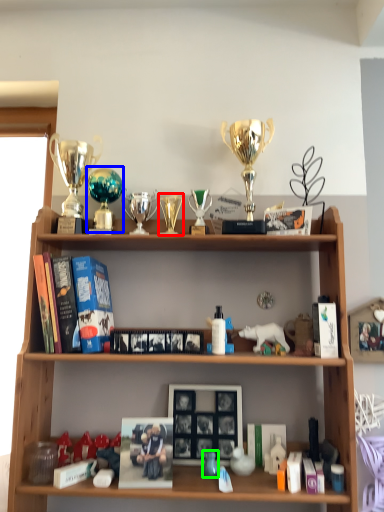
Question: Considering the real-world distances, which object is farthest from candle holder (highlighted by a red box)? trophy (highlighted by a blue box) or toy (highlighted by a green box)?

Choices:
 (A) trophy
 (B) toy

Answer: (B)